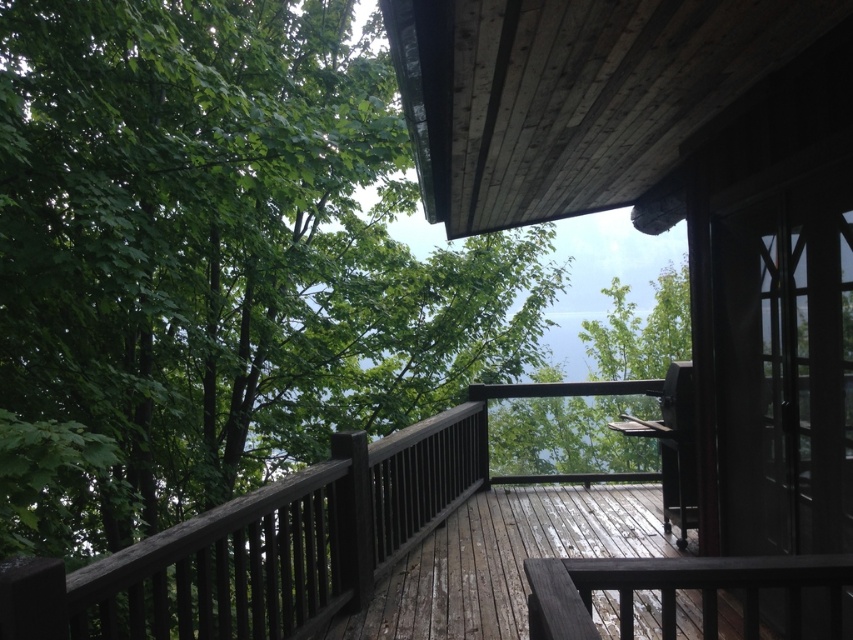
You are standing on the wooden deck and want to reach a specific point marked at coordinates point (148, 179). If your maximum reach is 3 meters, can you touch that point without moving closer?

The distance of point (148, 179) from camera is 3.82 meters, which is beyond your 3 meter reach. You cannot touch it without moving closer.

Based on the photo, you are standing on the wooden deck attached to the cabin and looking towards the green leafy tree at upper left marked by point (215, 260). Can you see the sky through the tree branches from your current position?

The green leafy tree at upper left marked by point (215, 260) is part of the dense canopy that partially obscures the sky, so yes, you can see the sky through the tree branches from your current position.